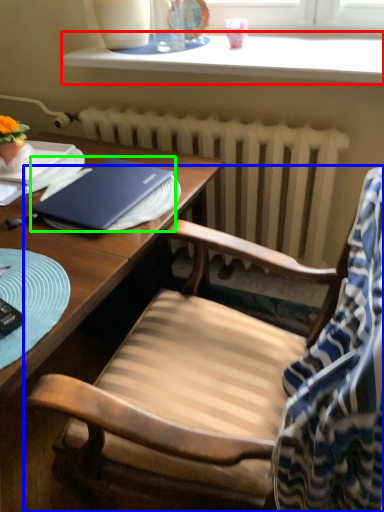
Question: Which object is positioned farthest from window sill (highlighted by a red box)? Select from chair (highlighted by a blue box) and notebook (highlighted by a green box).

Choices:
 (A) chair
 (B) notebook

Answer: (A)